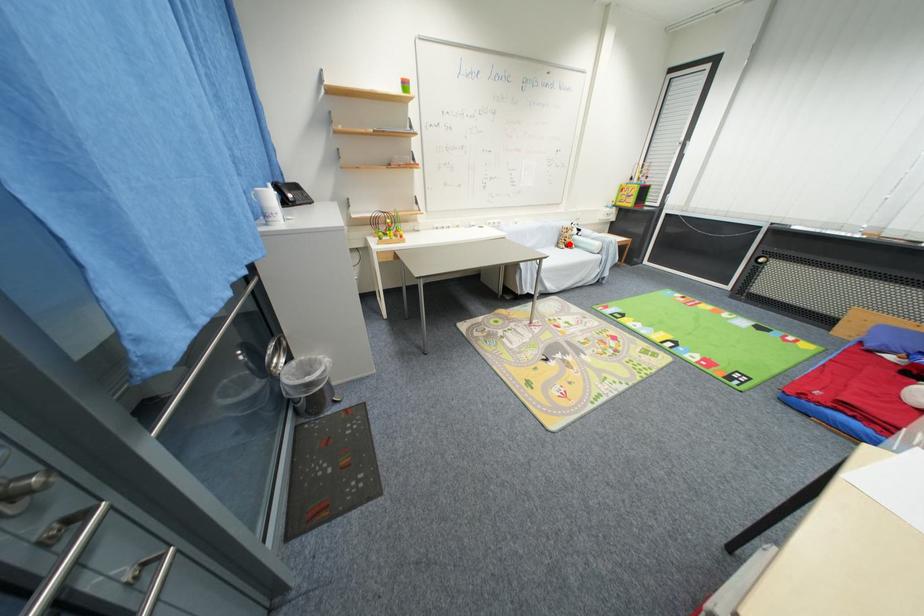
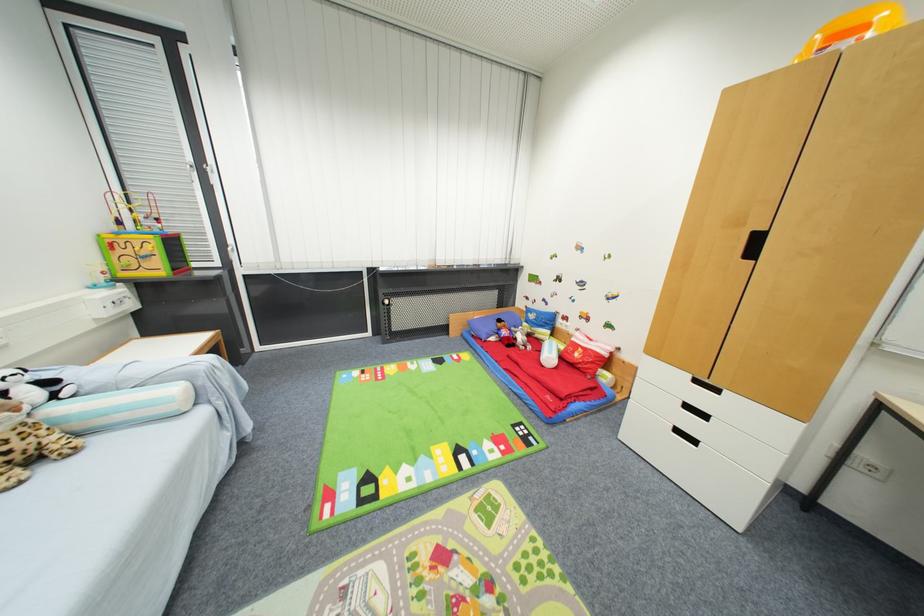
Question: I am providing you with two images of the same scene from different viewpoints. Image1 has a red point marked. In image2, the corresponding 3D location appears at what relative position? Reply with the corresponding letter.

Choices:
 (A) Closer
 (B) Farther

Answer: (A)